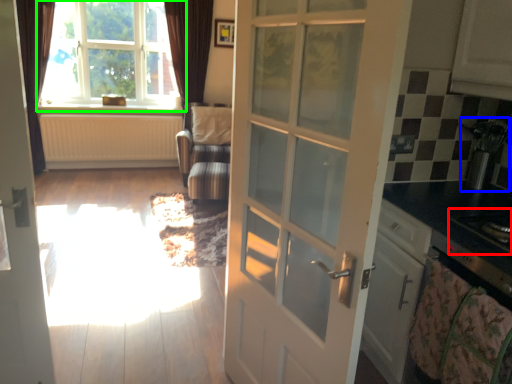
Question: Which is farther away from appliance (highlighted by a red box)? appliance (highlighted by a blue box) or window (highlighted by a green box)?

Choices:
 (A) appliance
 (B) window

Answer: (B)